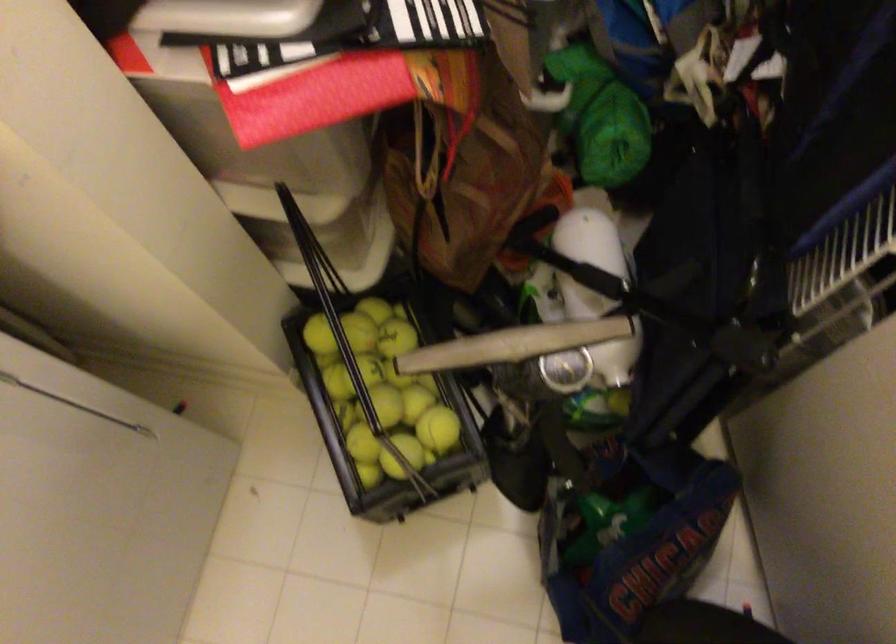
What do you see at coordinates (309, 251) in the screenshot? I see `the black basket handle` at bounding box center [309, 251].